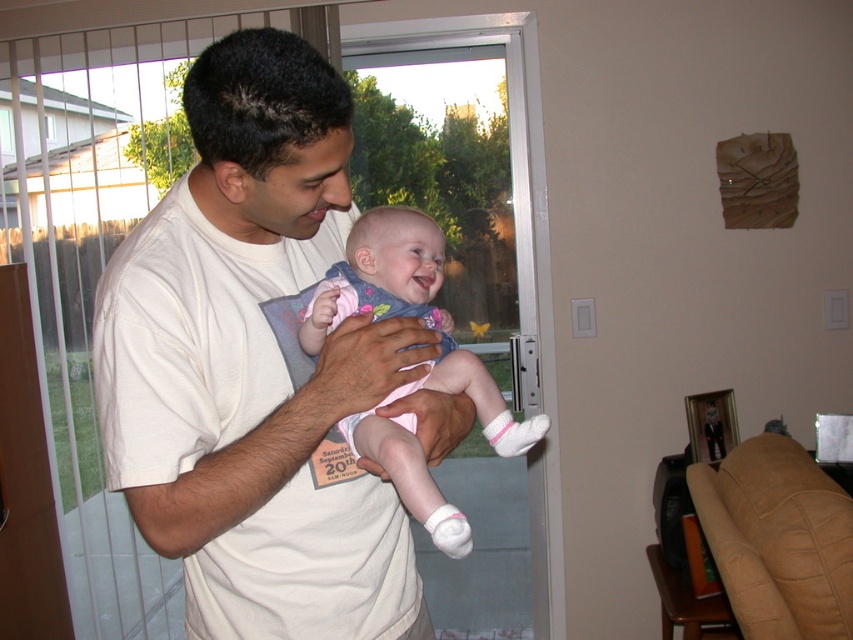
Is point (283, 179) positioned behind point (502, 452)?

No, (283, 179) is in front of (502, 452).

How far apart are white cotton shirt at center and pink fabric baby at center?

They are 4.96 inches apart.

This screenshot has height=640, width=853. What do you see at coordinates (253, 365) in the screenshot?
I see `white cotton shirt at center` at bounding box center [253, 365].

Where is `white cotton shirt at center`? This screenshot has height=640, width=853. white cotton shirt at center is located at coordinates (253, 365).